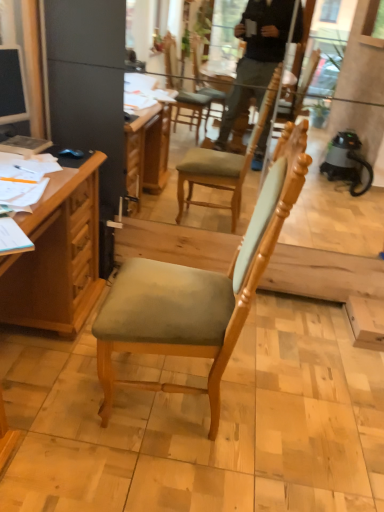
What is the approximate height of hardcover book at left?

It is 0.95 inches.

The height and width of the screenshot is (512, 384). What are the coordinates of `blue matte computer mouse at upper left` in the screenshot? It's located at (71, 153).

Which of these two, light brown wood chair at center or matte black monitor at left, stands taller?

light brown wood chair at center.

From a real-world perspective, which is physically above, light brown wood chair at center or matte black monitor at left?

matte black monitor at left.

Does point (248, 230) lie in front of point (9, 83)?

Yes, point (248, 230) is closer to viewer.

Is hardcover book at left next to wooden desk at left and touching it?

No, hardcover book at left is not beside wooden desk at left.

Locate an element on the screen. The width and height of the screenshot is (384, 512). desk located on the left of hardcover book at left is located at coordinates (58, 254).

Is hardcover book at left positioned beyond the bounds of wooden desk at left?

No, hardcover book at left is inside or overlapping with wooden desk at left.

Does blue matte computer mouse at upper left have a larger size compared to light brown wood chair at center?

No, blue matte computer mouse at upper left is not bigger than light brown wood chair at center.

From a real-world perspective, which object rests below the other?

light brown wood chair at center, from a real-world perspective.

Could you tell me if blue matte computer mouse at upper left is facing light brown wood chair at center?

No, blue matte computer mouse at upper left is not aimed at light brown wood chair at center.

Is hardcover book at left not close to blue matte computer mouse at upper left?

No, hardcover book at left is in close proximity to blue matte computer mouse at upper left.

Could you tell me if hardcover book at left is turned towards blue matte computer mouse at upper left?

Yes, hardcover book at left is turned towards blue matte computer mouse at upper left.

Considering the sizes of objects hardcover book at left and blue matte computer mouse at upper left in the image provided, who is shorter, hardcover book at left or blue matte computer mouse at upper left?

Standing shorter between the two is hardcover book at left.

Is hardcover book at left situated inside blue matte computer mouse at upper left or outside?

hardcover book at left is spatially situated outside blue matte computer mouse at upper left.

In the scene shown: Visually, is matte black monitor at left positioned to the left or to the right of light brown wood chair at center?

From the image, it's evident that matte black monitor at left is to the left of light brown wood chair at center.

Is matte black monitor at left turned away from light brown wood chair at center?

matte black monitor at left is not turned away from light brown wood chair at center.

Considering the sizes of objects matte black monitor at left and light brown wood chair at center in the image provided, who is shorter, matte black monitor at left or light brown wood chair at center?

matte black monitor at left is shorter.

Is matte black monitor at left positioned in front of light brown wood chair at center?

No, matte black monitor at left is behind light brown wood chair at center.

In the image, is blue matte computer mouse at upper left positioned in front of or behind wooden desk at left?

In the image, blue matte computer mouse at upper left appears behind wooden desk at left.

From the picture: Would you say blue matte computer mouse at upper left is a long distance from wooden desk at left?

Actually, blue matte computer mouse at upper left and wooden desk at left are a little close together.

Which is more to the right, blue matte computer mouse at upper left or wooden desk at left?

blue matte computer mouse at upper left is more to the right.

Can you tell me how much matte black monitor at left and hardcover book at left differ in facing direction?

21.2 degrees.

From a real-world perspective, between matte black monitor at left and hardcover book at left, who is vertically higher?

From a 3D spatial view, matte black monitor at left is above.

From the picture: Is matte black monitor at left wider or thinner than hardcover book at left?

Considering their sizes, matte black monitor at left looks slimmer than hardcover book at left.

At what (x,y) coordinates should I click in order to perform the action: click on chair on the right of matte black monitor at left. Please return your answer as a coordinate pair (x, y). Looking at the image, I should click on (198, 292).

At what (x,y) coordinates should I click in order to perform the action: click on desk on the left side of hardcover book at left. Please return your answer as a coordinate pair (x, y). The height and width of the screenshot is (512, 384). Looking at the image, I should click on (58, 254).

Which object lies further to the anchor point blue matte computer mouse at upper left, wooden desk at left or matte black monitor at left?

Among the two, wooden desk at left is located further to blue matte computer mouse at upper left.

Based on their spatial positions, is light brown wood chair at center or hardcover book at left closer to blue matte computer mouse at upper left?

hardcover book at left is closer to blue matte computer mouse at upper left.

Based on their spatial positions, is blue matte computer mouse at upper left or matte black monitor at left closer to hardcover book at left?

blue matte computer mouse at upper left lies closer to hardcover book at left than the other object.

From the image, which object appears to be nearer to matte black monitor at left, hardcover book at left or light brown wood chair at center?

hardcover book at left is positioned closer to the anchor matte black monitor at left.

When comparing their distances from matte black monitor at left, does blue matte computer mouse at upper left or wooden desk at left seem further?

wooden desk at left is positioned further to the anchor matte black monitor at left.

When comparing their distances from wooden desk at left, does hardcover book at left or matte black monitor at left seem further?

matte black monitor at left.

Looking at the image, which one is located further to wooden desk at left, blue matte computer mouse at upper left or matte black monitor at left?

Based on the image, matte black monitor at left appears to be further to wooden desk at left.

Estimate the real-world distances between objects in this image. Which object is further from matte black monitor at left, wooden desk at left or blue matte computer mouse at upper left?

wooden desk at left is further to matte black monitor at left.

The image size is (384, 512). In order to click on book between light brown wood chair at center and blue matte computer mouse at upper left from front to back in this screenshot , I will do `click(24, 145)`.

This screenshot has height=512, width=384. I want to click on book between matte black monitor at left and light brown wood chair at center from left to right, so click(x=24, y=145).

Find the location of `desk located between matte black monitor at left and light brown wood chair at center in the left-right direction`. desk located between matte black monitor at left and light brown wood chair at center in the left-right direction is located at coordinates (58, 254).

Identify the location of television positioned between wooden desk at left and hardcover book at left from near to far. The width and height of the screenshot is (384, 512). (12, 86).